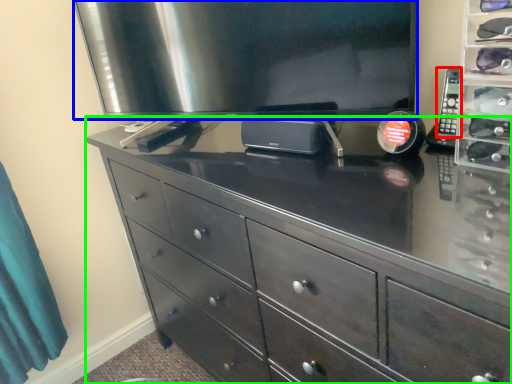
Question: Which is farther away from control (highlighted by a red box)? television (highlighted by a blue box) or chest of drawers (highlighted by a green box)?

Choices:
 (A) television
 (B) chest of drawers

Answer: (B)